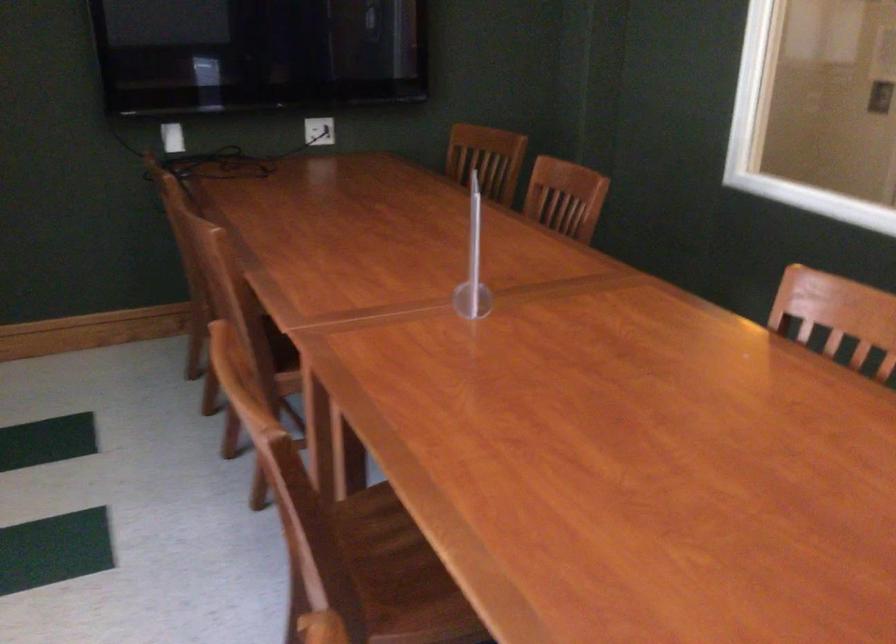
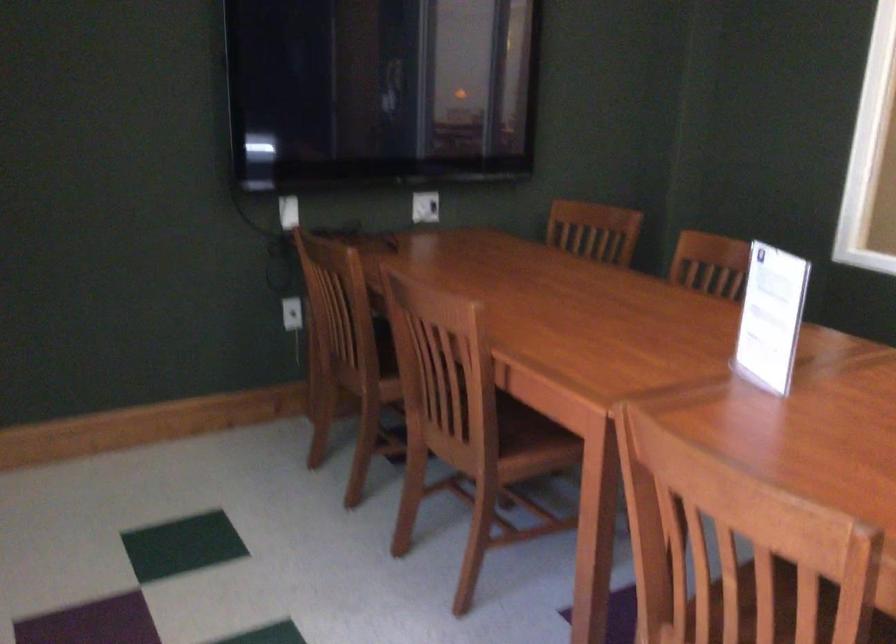
Question: How did the camera likely rotate?

Choices:
 (A) Left
 (B) Right
 (C) Up
 (D) Down

Answer: (C)